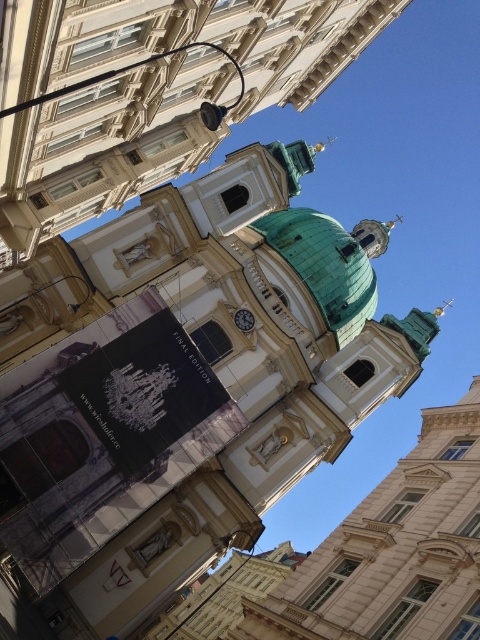
You are an architect visiting this historic site. You notice two prominent features on the building facade. Which one is bigger between the green dome at center and the white glossy clock at center?

The green dome at center is larger in size than the white glossy clock at center.

You are an architect analyzing the building layout. Based on the image, which object, the green copper dome at center or the white glossy clock at center, is positioned higher in the vertical structure?

The green copper dome at center is positioned higher than the white glossy clock at center in the vertical structure.